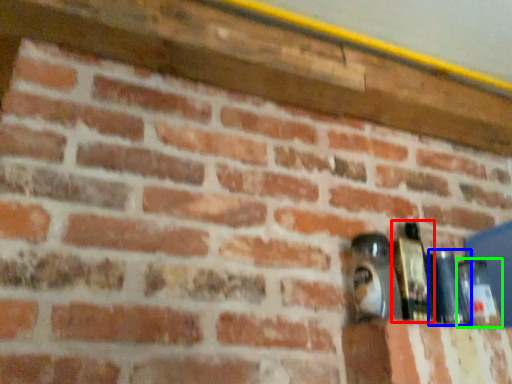
Question: Based on their relative distances, which object is farther from bottle (highlighted by a red box)? Choose from bottle (highlighted by a blue box) and bottle (highlighted by a green box).

Choices:
 (A) bottle
 (B) bottle

Answer: (B)